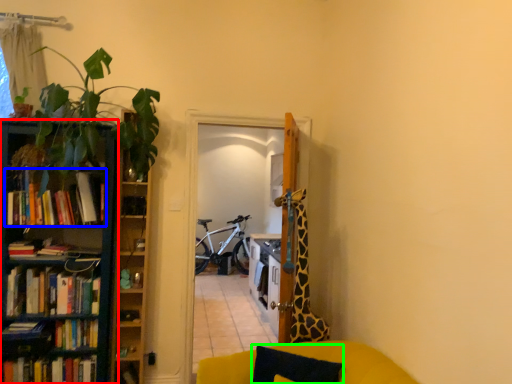
Question: Which is farther away from bookcase (highlighted by a red box)? book (highlighted by a blue box) or pillow (highlighted by a green box)?

Choices:
 (A) book
 (B) pillow

Answer: (B)